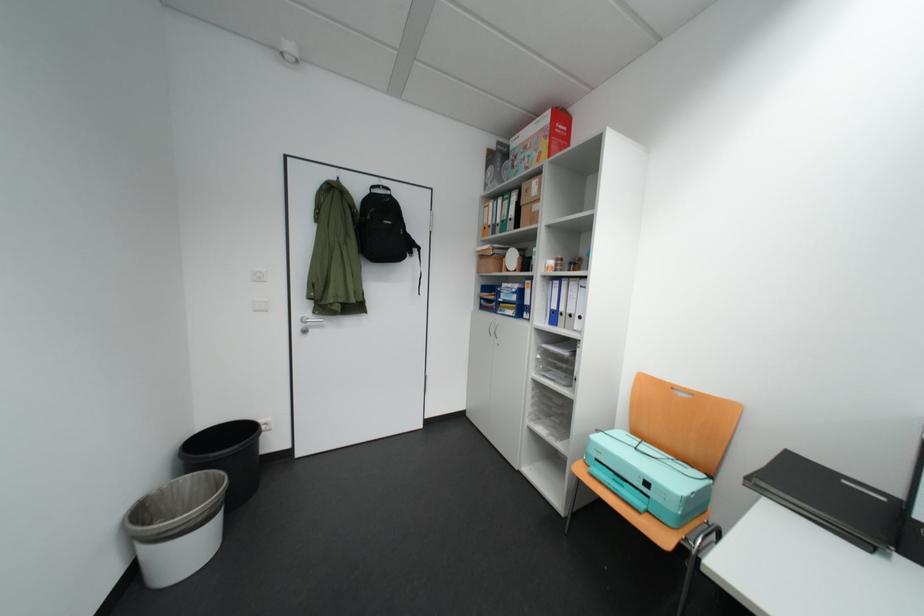
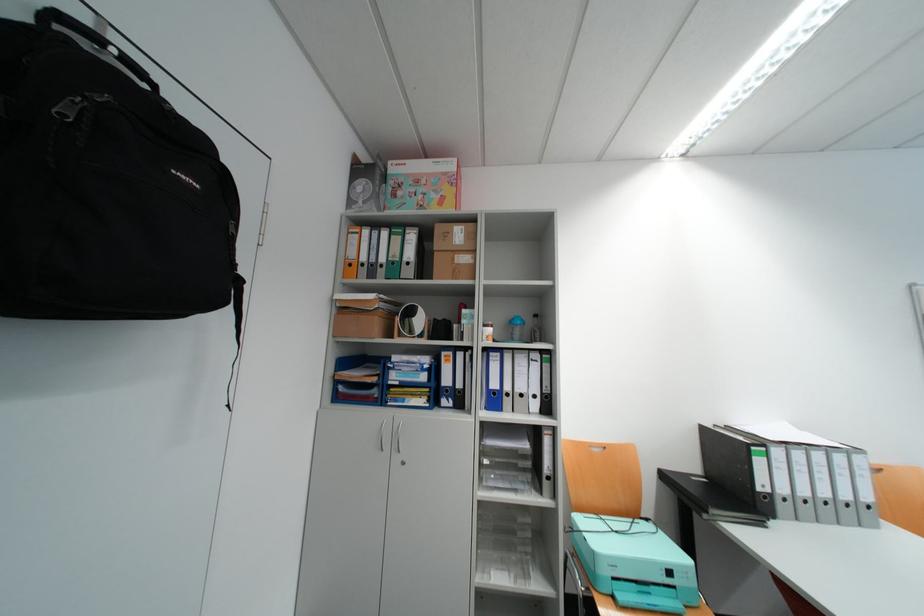
Locate, in the second image, the point that corresponds to point (686, 389) in the first image.

(602, 447)